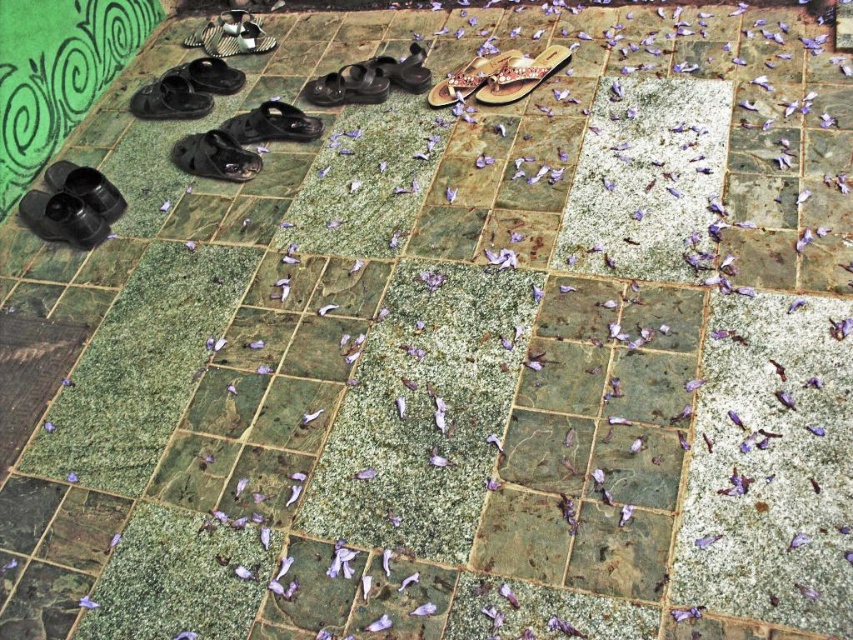
You are trying to decide which pair of sandals to take with you. The beige woven sandal at upper center and the matte black sandals at upper left are both options. Which pair has a smaller width?

The beige woven sandal at upper center has a smaller width than the matte black sandals at upper left.

You are standing in a room with a tiled floor and want to place a new pair of sandals. You have a beige woven sandal at upper center and matte black sandals at upper left. Which sandal is on the right side of the other?

The beige woven sandal at upper center is positioned on the right side of the matte black sandals at upper left.